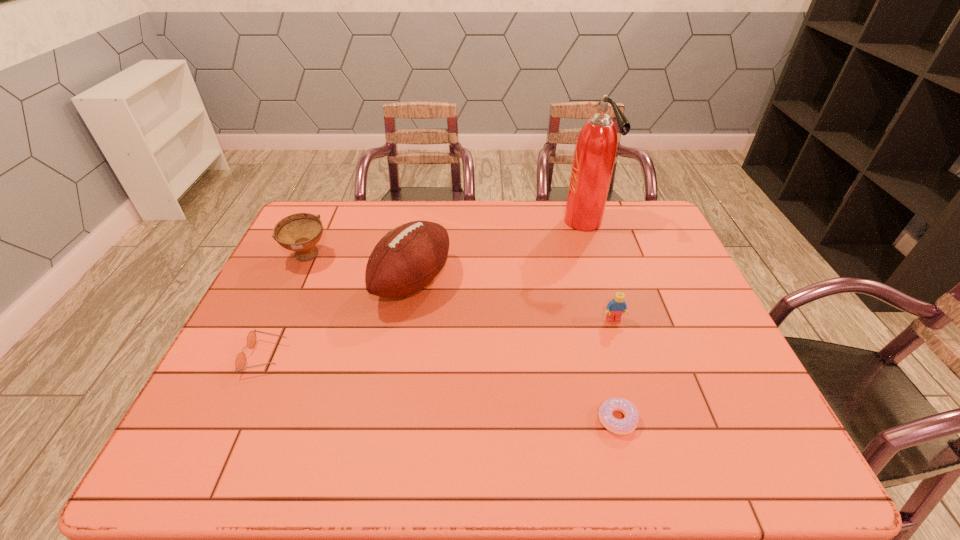
The height and width of the screenshot is (540, 960). In the image, there is a desktop. What are the coordinates of `free space at the far edge` in the screenshot? It's located at (463, 211).

Image resolution: width=960 pixels, height=540 pixels. Identify the location of free region at the near edge. (685, 433).

Where is `blank space at the left edge of the desktop`? The width and height of the screenshot is (960, 540). blank space at the left edge of the desktop is located at coordinates (276, 388).

At what (x,y) coordinates should I click in order to perform the action: click on vacant region at the right edge of the desktop. Please return your answer as a coordinate pair (x, y). The height and width of the screenshot is (540, 960). Looking at the image, I should click on (720, 417).

This screenshot has height=540, width=960. In order to click on vacant region at the far left corner of the desktop in this screenshot , I will do `click(324, 235)`.

Find the location of `vacant space at the far right corner of the desktop`. vacant space at the far right corner of the desktop is located at coordinates (626, 226).

I want to click on unoccupied position between the fifth tallest object and the tallest object, so click(x=424, y=289).

The image size is (960, 540). I want to click on free spot between the fourth tallest object and the second nearest object, so click(440, 338).

This screenshot has width=960, height=540. Find the location of `free space between the third tallest object and the fifth shortest object`. free space between the third tallest object and the fifth shortest object is located at coordinates (360, 269).

You are a GUI agent. You are given a task and a screenshot of the screen. Output one action in this format:
    pyautogui.click(x=<x>, y=<y>)
    Task: Click on the vacant area that lies between the Lego and the soup bowl
    The height and width of the screenshot is (540, 960).
    Given the screenshot: What is the action you would take?
    pyautogui.click(x=461, y=288)